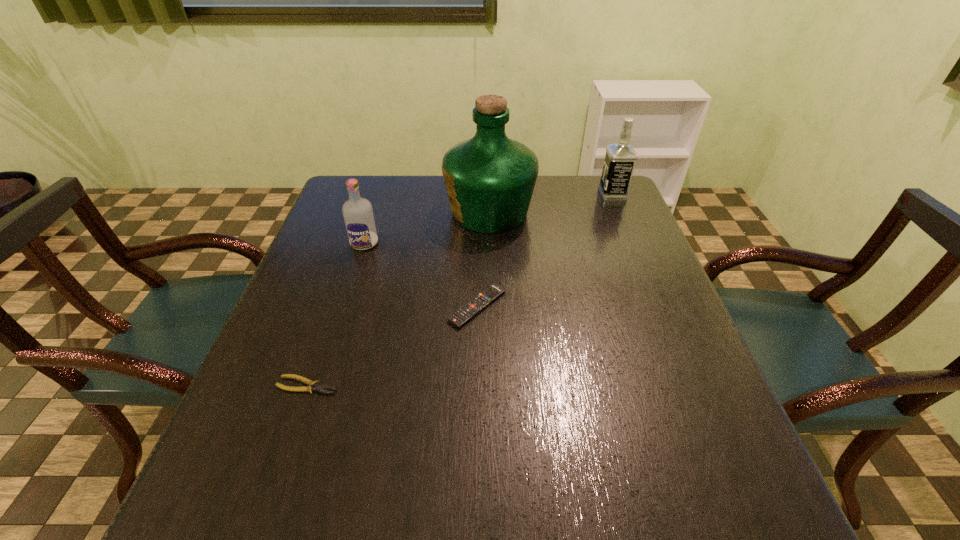
At what (x,y) coordinates should I click in order to perform the action: click on liquor. Please return your answer as a coordinate pair (x, y). Looking at the image, I should click on (489, 178).

What are the coordinates of `the fourth shortest object` in the screenshot? It's located at (620, 158).

I want to click on the taller vodka, so click(x=620, y=158).

This screenshot has width=960, height=540. What are the coordinates of `the nearer vodka` in the screenshot? It's located at (358, 215).

Find the location of a particular element. This screenshot has height=540, width=960. the left vodka is located at coordinates (358, 215).

Locate an element on the screen. The width and height of the screenshot is (960, 540). the second shortest object is located at coordinates (470, 309).

Find the location of a particular element. The height and width of the screenshot is (540, 960). remote control is located at coordinates (470, 309).

This screenshot has width=960, height=540. Identify the location of the shortest object. (313, 385).

Locate an element on the screen. pliers is located at coordinates (313, 385).

Find the location of a particular element. This screenshot has width=960, height=540. vacant area located 0.140m on the label side of the liquor is located at coordinates (396, 212).